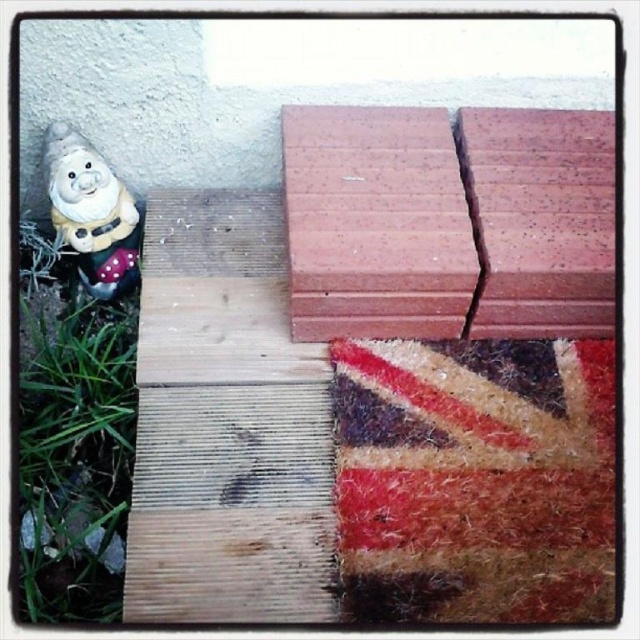
Does green grass at lower left have a lesser width compared to white ceramic gnome at upper left?

No.

Can you confirm if green grass at lower left is bigger than white ceramic gnome at upper left?

Correct, green grass at lower left is larger in size than white ceramic gnome at upper left.

Between point (44, 566) and point (52, 220), which one is positioned in front?

Point (44, 566) is in front.

Identify the location of green grass at lower left. This screenshot has width=640, height=640. (74, 451).

Is point (392, 278) positioned in front of point (96, 419)?

Yes, point (392, 278) is in front of point (96, 419).

Where is `red brick at center`? Image resolution: width=640 pixels, height=640 pixels. red brick at center is located at coordinates (449, 221).

Between red brick at center and white ceramic gnome at upper left, which one is positioned lower?

Positioned lower is white ceramic gnome at upper left.

Between red brick at center and white ceramic gnome at upper left, which one appears on the left side from the viewer's perspective?

Positioned to the left is white ceramic gnome at upper left.

Who is more distant from viewer, (296, 205) or (88, 177)?

The point (88, 177) is more distant.

Locate an element on the screen. Image resolution: width=640 pixels, height=640 pixels. red brick at center is located at coordinates (449, 221).